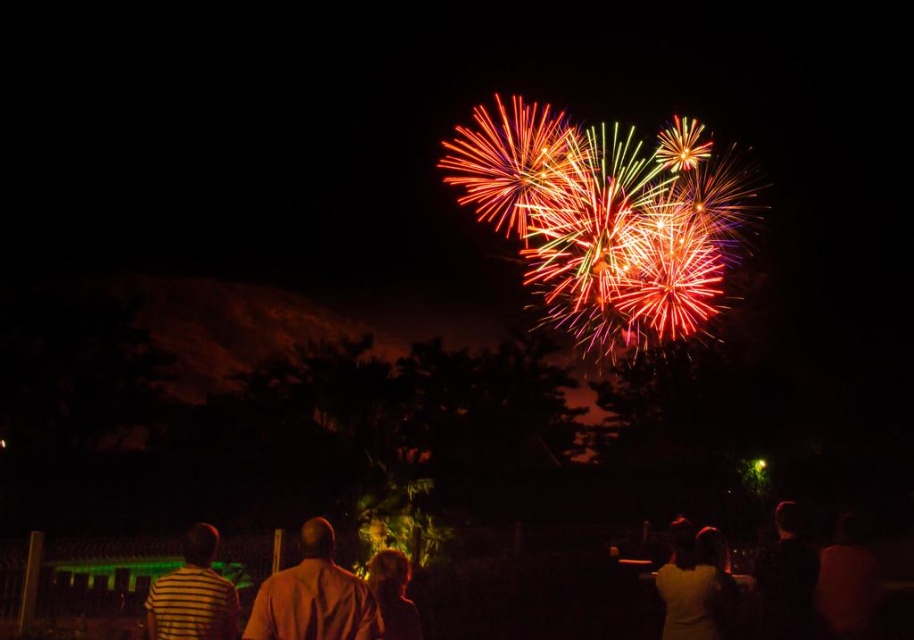
You are attending a fireworks show and notice two figures in the crowd. One is wearing a yellow matte shirt at lower right, and the other has blonde hair at center. Based on their sizes in the image, which figure is closer to you?

The yellow matte shirt at lower right is larger in size compared to the blonde hair at center, indicating it is closer to you.